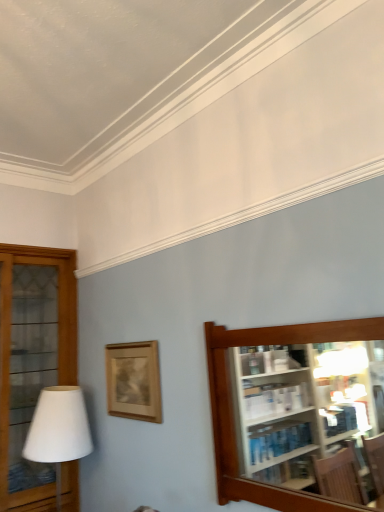
What is the approximate height of wooden glass cabinet at left, the second shelf from the right?

The height of wooden glass cabinet at left, the second shelf from the right, is 5.83 feet.

What do you see at coordinates (232, 408) in the screenshot? I see `brown wooden shelf at right, which appears as the 2th shelf when viewed from the left` at bounding box center [232, 408].

What do you see at coordinates (134, 381) in the screenshot?
I see `wooden picture frame at center` at bounding box center [134, 381].

The width and height of the screenshot is (384, 512). What are the coordinates of `wooden glass cabinet at left, the second shelf from the right` in the screenshot? It's located at (32, 361).

In order to click on the 1st shelf positioned above the white matte table lamp at left (from the image's perspective) in this screenshot , I will do `click(32, 361)`.

How different are the orientations of wooden glass cabinet at left, positioned as the 1th shelf in left-to-right order, and white matte table lamp at left in degrees?

They differ by 3.06 degrees in their facing directions.

Does wooden glass cabinet at left, the second shelf from the right, turn towards white matte table lamp at left?

Yes, wooden glass cabinet at left, the second shelf from the right, is facing white matte table lamp at left.

Is wooden glass cabinet at left, acting as the first shelf starting from the back, next to white matte table lamp at left?

No, wooden glass cabinet at left, acting as the first shelf starting from the back, is not next to white matte table lamp at left.

From a real-world perspective, is white matte table lamp at left positioned under brown wooden shelf at right, acting as the first shelf starting from the front, based on gravity?

Yes, from a real-world perspective, white matte table lamp at left is beneath brown wooden shelf at right, acting as the first shelf starting from the front.

Are white matte table lamp at left and brown wooden shelf at right, marked as the 1th shelf in a right-to-left arrangement, far apart?

Absolutely, white matte table lamp at left is distant from brown wooden shelf at right, marked as the 1th shelf in a right-to-left arrangement.

Looking at their sizes, would you say white matte table lamp at left is wider or thinner than brown wooden shelf at right, marked as the second shelf in a back-to-front arrangement?

white matte table lamp at left is wider than brown wooden shelf at right, marked as the second shelf in a back-to-front arrangement.

Considering the relative sizes of white matte table lamp at left and brown wooden shelf at right, which appears as the 2th shelf when viewed from the left, in the image provided, is white matte table lamp at left bigger than brown wooden shelf at right, which appears as the 2th shelf when viewed from the left,?

Correct, white matte table lamp at left is larger in size than brown wooden shelf at right, which appears as the 2th shelf when viewed from the left.

Between wooden glass cabinet at left, positioned as the 1th shelf in left-to-right order, and brown wooden shelf at right, marked as the 1th shelf in a right-to-left arrangement, which one has larger size?

With larger size is wooden glass cabinet at left, positioned as the 1th shelf in left-to-right order.

What's the angular difference between wooden glass cabinet at left, positioned as the 1th shelf in left-to-right order, and brown wooden shelf at right, which appears as the 2th shelf when viewed from the left,'s facing directions?

There is a 88.8-degree angle between the facing directions of wooden glass cabinet at left, positioned as the 1th shelf in left-to-right order, and brown wooden shelf at right, which appears as the 2th shelf when viewed from the left.

This screenshot has height=512, width=384. I want to click on shelf above the wooden glass cabinet at left, acting as the first shelf starting from the back (from the image's perspective), so click(232, 408).

Does white matte table lamp at left have a lesser height compared to wooden glass cabinet at left, positioned as the 1th shelf in left-to-right order?

Correct, white matte table lamp at left is not as tall as wooden glass cabinet at left, positioned as the 1th shelf in left-to-right order.

Which object is thinner, white matte table lamp at left or wooden glass cabinet at left, placed as the 2th shelf when sorted from front to back?

Thinner between the two is white matte table lamp at left.

Where is `shelf behind the white matte table lamp at left`? The height and width of the screenshot is (512, 384). shelf behind the white matte table lamp at left is located at coordinates (32, 361).

Considering the relative sizes of white matte table lamp at left and wooden glass cabinet at left, the second shelf from the right, in the image provided, is white matte table lamp at left smaller than wooden glass cabinet at left, the second shelf from the right,?

Yes, white matte table lamp at left is smaller than wooden glass cabinet at left, the second shelf from the right.

At what (x,y) coordinates should I click in order to perform the action: click on picture frame on the right of wooden glass cabinet at left, placed as the 2th shelf when sorted from front to back. Please return your answer as a coordinate pair (x, y). Image resolution: width=384 pixels, height=512 pixels. Looking at the image, I should click on (134, 381).

Who is bigger, wooden glass cabinet at left, placed as the 2th shelf when sorted from front to back, or wooden picture frame at center?

With larger size is wooden glass cabinet at left, placed as the 2th shelf when sorted from front to back.

Can we say wooden glass cabinet at left, positioned as the 1th shelf in left-to-right order, lies outside wooden picture frame at center?

Yes.

Is wooden glass cabinet at left, placed as the 2th shelf when sorted from front to back, thinner than wooden picture frame at center?

In fact, wooden glass cabinet at left, placed as the 2th shelf when sorted from front to back, might be wider than wooden picture frame at center.

Can you confirm if wooden picture frame at center is thinner than wooden glass cabinet at left, placed as the 2th shelf when sorted from front to back?

Yes.

From a real-world perspective, is wooden picture frame at center above or below wooden glass cabinet at left, the second shelf from the right?

wooden picture frame at center is above wooden glass cabinet at left, the second shelf from the right.

How distant is wooden picture frame at center from wooden glass cabinet at left, placed as the 2th shelf when sorted from front to back?

They are 27.19 inches apart.

Who is taller, wooden picture frame at center or wooden glass cabinet at left, acting as the first shelf starting from the back?

wooden glass cabinet at left, acting as the first shelf starting from the back, is taller.

Locate an element on the screen. The height and width of the screenshot is (512, 384). picture frame behind the brown wooden shelf at right, which appears as the 2th shelf when viewed from the left is located at coordinates (134, 381).

Between wooden picture frame at center and brown wooden shelf at right, which appears as the 2th shelf when viewed from the left, which one has smaller size?

wooden picture frame at center.

From the image's perspective, who appears lower, wooden picture frame at center or brown wooden shelf at right, acting as the first shelf starting from the front?

wooden picture frame at center appears lower in the image.

Where is `shelf on the left of white matte table lamp at left`? Image resolution: width=384 pixels, height=512 pixels. shelf on the left of white matte table lamp at left is located at coordinates (32, 361).

Where is `table lamp below the brown wooden shelf at right, acting as the first shelf starting from the front (from a real-world perspective)`? The height and width of the screenshot is (512, 384). table lamp below the brown wooden shelf at right, acting as the first shelf starting from the front (from a real-world perspective) is located at coordinates (58, 430).

Which object lies further to the anchor point white matte table lamp at left, wooden glass cabinet at left, acting as the first shelf starting from the back, or brown wooden shelf at right, marked as the second shelf in a back-to-front arrangement?

The object further to white matte table lamp at left is brown wooden shelf at right, marked as the second shelf in a back-to-front arrangement.

Looking at the image, which one is located further to brown wooden shelf at right, marked as the second shelf in a back-to-front arrangement, wooden glass cabinet at left, positioned as the 1th shelf in left-to-right order, or wooden picture frame at center?

wooden glass cabinet at left, positioned as the 1th shelf in left-to-right order.

Looking at this image, based on their spatial positions, is wooden picture frame at center or white matte table lamp at left closer to wooden glass cabinet at left, acting as the first shelf starting from the back?

white matte table lamp at left lies closer to wooden glass cabinet at left, acting as the first shelf starting from the back, than the other object.

When comparing their distances from white matte table lamp at left, does wooden picture frame at center or wooden glass cabinet at left, the second shelf from the right, seem closer?

wooden picture frame at center.

Considering their positions, is white matte table lamp at left positioned closer to wooden picture frame at center than brown wooden shelf at right, acting as the first shelf starting from the front?

white matte table lamp at left is positioned closer to the anchor wooden picture frame at center.

Which object lies further to the anchor point wooden glass cabinet at left, placed as the 2th shelf when sorted from front to back, brown wooden shelf at right, acting as the first shelf starting from the front, or wooden picture frame at center?

Based on the image, brown wooden shelf at right, acting as the first shelf starting from the front, appears to be further to wooden glass cabinet at left, placed as the 2th shelf when sorted from front to back.

Considering their positions, is brown wooden shelf at right, marked as the 1th shelf in a right-to-left arrangement, positioned closer to wooden glass cabinet at left, positioned as the 1th shelf in left-to-right order, than white matte table lamp at left?

white matte table lamp at left.

Based on their spatial positions, is wooden picture frame at center or wooden glass cabinet at left, placed as the 2th shelf when sorted from front to back, further from brown wooden shelf at right, acting as the first shelf starting from the front?

wooden glass cabinet at left, placed as the 2th shelf when sorted from front to back, is further to brown wooden shelf at right, acting as the first shelf starting from the front.

Where is `table lamp between wooden glass cabinet at left, the second shelf from the right, and wooden picture frame at center from left to right`? table lamp between wooden glass cabinet at left, the second shelf from the right, and wooden picture frame at center from left to right is located at coordinates (58, 430).

Where is `picture frame between white matte table lamp at left and brown wooden shelf at right, marked as the 1th shelf in a right-to-left arrangement`? The height and width of the screenshot is (512, 384). picture frame between white matte table lamp at left and brown wooden shelf at right, marked as the 1th shelf in a right-to-left arrangement is located at coordinates (134, 381).

Find the location of a particular element. This screenshot has width=384, height=512. picture frame between wooden glass cabinet at left, positioned as the 1th shelf in left-to-right order, and brown wooden shelf at right, which appears as the 2th shelf when viewed from the left is located at coordinates (134, 381).

The height and width of the screenshot is (512, 384). Find the location of `table lamp between wooden glass cabinet at left, placed as the 2th shelf when sorted from front to back, and brown wooden shelf at right, marked as the 1th shelf in a right-to-left arrangement, from left to right`. table lamp between wooden glass cabinet at left, placed as the 2th shelf when sorted from front to back, and brown wooden shelf at right, marked as the 1th shelf in a right-to-left arrangement, from left to right is located at coordinates (58, 430).